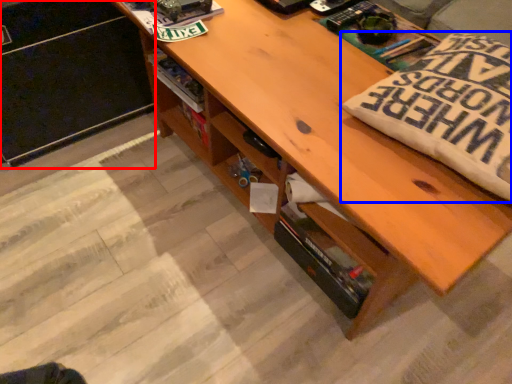
Question: Among these objects, which one is farthest to the camera, file cabinet (highlighted by a red box) or throw pillow (highlighted by a blue box)?

Choices:
 (A) file cabinet
 (B) throw pillow

Answer: (A)